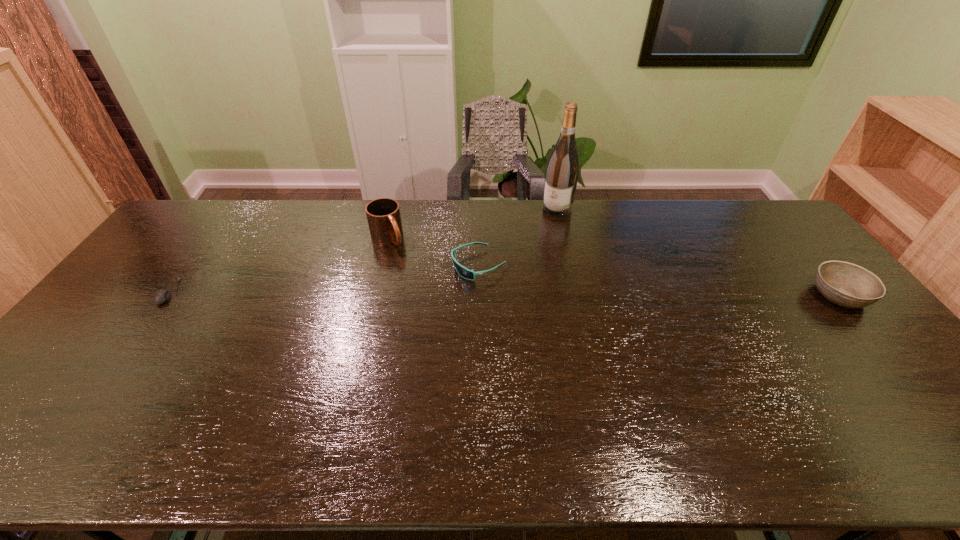
The width and height of the screenshot is (960, 540). In order to click on free space between the leftmost object and the second object from left to right in this screenshot , I will do (278, 265).

Find the location of a particular element. free area in between the third shortest object and the tallest object is located at coordinates (698, 252).

Find the location of a particular element. Image resolution: width=960 pixels, height=540 pixels. free point between the farthest object and the sunglasses is located at coordinates (518, 237).

You are a GUI agent. You are given a task and a screenshot of the screen. Output one action in this format:
    pyautogui.click(x=<x>, y=<y>)
    Task: Click on the vacant area that lies between the shortest object and the farthest object
    This screenshot has width=960, height=540.
    Given the screenshot: What is the action you would take?
    pyautogui.click(x=363, y=251)

You are a GUI agent. You are given a task and a screenshot of the screen. Output one action in this format:
    pyautogui.click(x=<x>, y=<y>)
    Task: Click on the free space between the bowl and the second object from right to left
    Image resolution: width=960 pixels, height=540 pixels.
    Given the screenshot: What is the action you would take?
    pyautogui.click(x=698, y=252)

Locate an element on the screen. The height and width of the screenshot is (540, 960). vacant point located between the rightmost object and the fourth shortest object is located at coordinates (613, 266).

Identify the location of free area in between the fourth shortest object and the mouse. click(278, 265).

You are a GUI agent. You are given a task and a screenshot of the screen. Output one action in this format:
    pyautogui.click(x=<x>, y=<y>)
    Task: Click on the vacant area that lies between the second object from right to left and the leftmost object
    This screenshot has height=540, width=960.
    Given the screenshot: What is the action you would take?
    point(363,251)

At what (x,y) coordinates should I click in order to perform the action: click on empty space that is in between the mug and the third object from left to right. Please return your answer as a coordinate pair (x, y). Looking at the image, I should click on (433, 251).

In order to click on empty space between the fourth object from right to left and the second shortest object in this screenshot , I will do `click(433, 251)`.